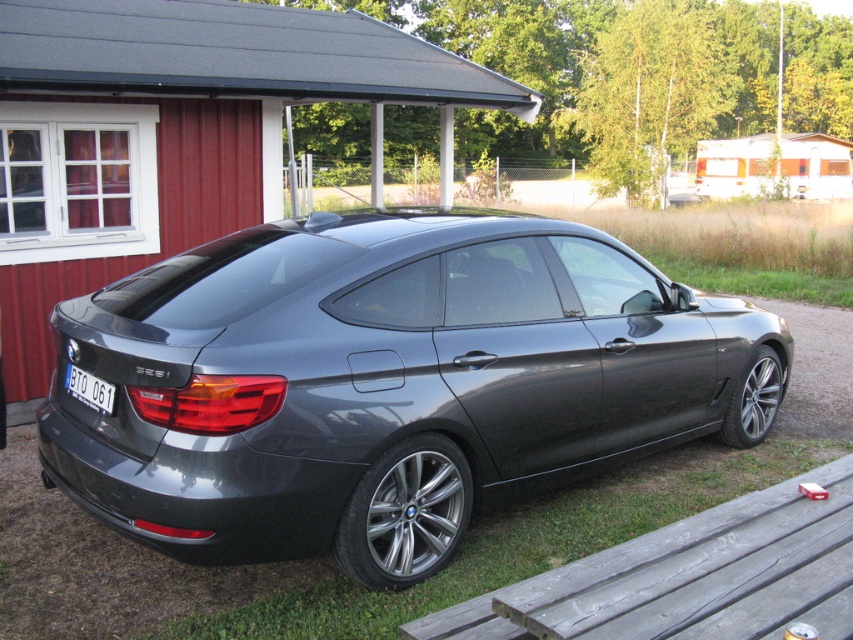
You are a photographer setting up a shot of the satin metallic car at center and the white plastic license plate at rear. You want to frame both objects in the same shot. Which object should you position closer to the edge of the frame to ensure both fit?

The satin metallic car at center is wider than the white plastic license plate at rear, so you should position the satin metallic car at center closer to the edge of the frame to ensure both fit.

You are a delivery person trying to attach a new license plate to the BMW 3 Series Gran Turismo. The current license plate, white plastic license plate at rear, is blocking the spot where the white wood trailer at upper right needs to be mounted. Can you move the license plate to the other side to make space for the trailer?

The white wood trailer at upper right is positioned on the right side of the white plastic license plate at rear, meaning the trailer is already mounted to the right of the license plate. To make space, you would need to move the license plate to the left side of the trailer instead of the right.

You are standing in front of the BMW 3 Series Gran Turismo parked near the red wooden building. You notice two points marked on the car. The first point is at coordinate point (299, 432) and the second is at coordinate point (842, 147). Which point appears closer to you?

Point (299, 432) is closer to the camera than point (842, 147).